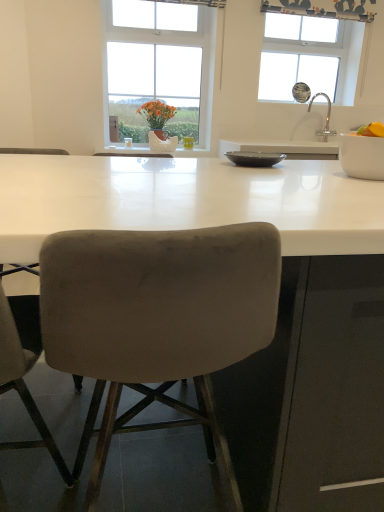
Question: Based on their sizes in the image, would you say white glossy bowl at right, the 1th bowl positioned from the right, is bigger or smaller than silver metallic faucet at upper right?

Choices:
 (A) big
 (B) small

Answer: (B)

Question: Looking at their shapes, would you say white glossy bowl at right, the first bowl when ordered from front to back, is wider or thinner than silver metallic faucet at upper right?

Choices:
 (A) wide
 (B) thin

Answer: (A)

Question: Which object is positioned closest to the transparent glass window at upper right, marked as the second window in a left-to-right arrangement?

Choices:
 (A) velvet beige chair at lower left, the second chair positioned from the right
 (B) orange matte at right
 (C) white ceramic vase at center
 (D) silver metallic faucet at upper right
 (E) matte black bowl at center, which is the 2th bowl in front-to-back order

Answer: (D)

Question: Estimate the real-world distances between objects in this image. Which object is closer to the matte black bowl at center, which is counted as the 1th bowl, starting from the left?

Choices:
 (A) white ceramic vase at center
 (B) velvet beige chair at lower left, which ranks as the first chair in left-to-right order
 (C) orange matte at right
 (D) transparent glass window at upper right, marked as the second window in a left-to-right arrangement
 (E) silver metallic faucet at upper right

Answer: (C)